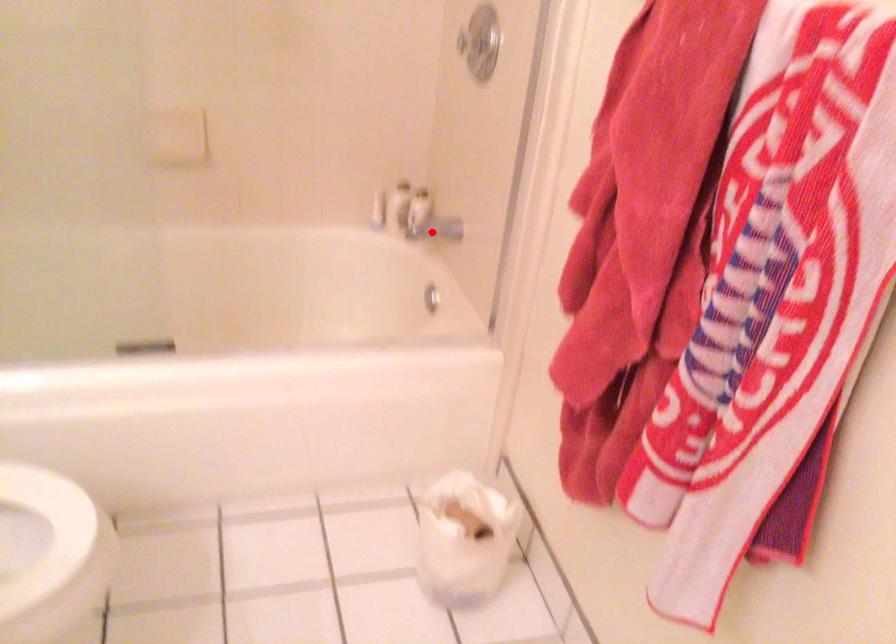
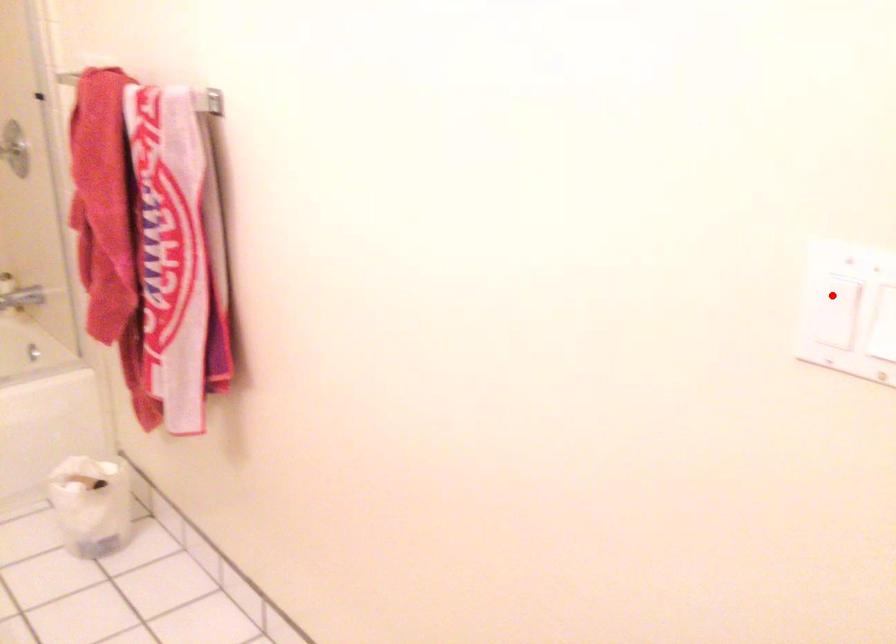
I am providing you with two images of the same scene from different viewpoints. A red point is marked on the first image and another point is marked on the second image. Is the red point in image1 aligned with the point shown in image2?

No